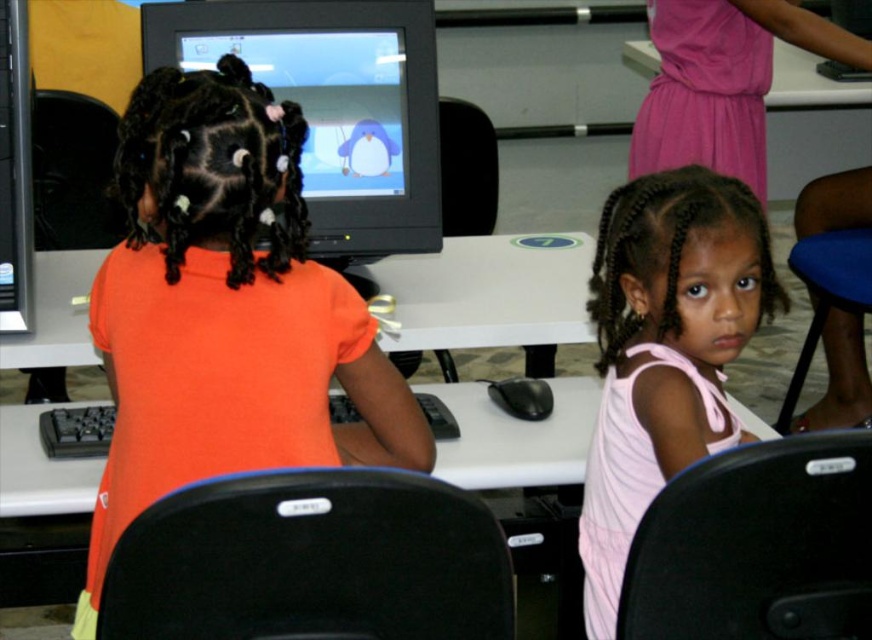
Question: From the image, what is the correct spatial relationship of matte black monitor at upper center in relation to white glossy table at upper center?

Choices:
 (A) right
 (B) left

Answer: (B)

Question: Considering the real-world distances, which object is farthest from the orange matte shirt at center?

Choices:
 (A) black plastic keyboard at lower left
 (B) pink satin dress at center
 (C) white plastic table at center

Answer: (C)

Question: Which is farther from the orange matte shirt at center?

Choices:
 (A) black plastic keyboard at lower left
 (B) pink satin dress at center
 (C) matte black monitor at upper center

Answer: (C)

Question: Considering the relative positions of pink satin dress at center and matte black monitor at upper center in the image provided, where is pink satin dress at center located with respect to matte black monitor at upper center?

Choices:
 (A) right
 (B) left

Answer: (A)

Question: Does matte black monitor at upper center have a lesser width compared to white plastic table at center?

Choices:
 (A) yes
 (B) no

Answer: (B)

Question: Which of the following is the farthest from the observer?

Choices:
 (A) (9, 228)
 (B) (103, 330)
 (C) (802, 97)
 (D) (421, 68)

Answer: (C)